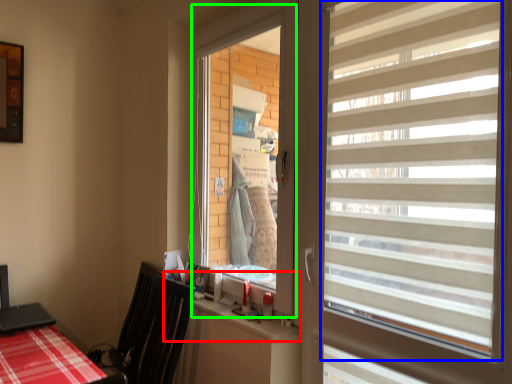
Question: Estimate the real-world distances between objects in this image. Which object is closer to counter top (highlighted by a red box), window blind (highlighted by a blue box) or window screen (highlighted by a green box)?

Choices:
 (A) window blind
 (B) window screen

Answer: (B)